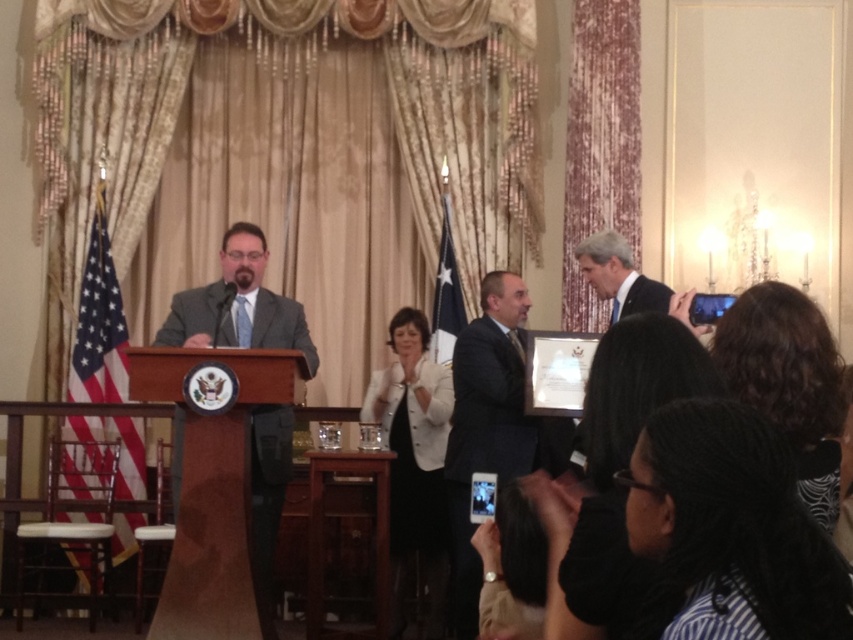
This screenshot has width=853, height=640. What do you see at coordinates (238, 305) in the screenshot?
I see `matte gray suit at left` at bounding box center [238, 305].

Which is more to the left, matte gray suit at left or dark blue suit at center?

matte gray suit at left is more to the left.

Locate an element on the screen. matte gray suit at left is located at coordinates (238, 305).

Locate an element on the screen. The height and width of the screenshot is (640, 853). matte gray suit at left is located at coordinates (238, 305).

Measure the distance between matte gray suit at left and camera.

matte gray suit at left is 11.56 meters from camera.

Is matte gray suit at left positioned before dark gray suit at center?

Yes, matte gray suit at left is in front of dark gray suit at center.

Is point (263, 593) farther from camera compared to point (486, 365)?

That is False.

Find the location of a particular element. The height and width of the screenshot is (640, 853). matte gray suit at left is located at coordinates (238, 305).

Who is taller, dark gray suit at center or dark blue suit at center?

With more height is dark gray suit at center.

Between point (495, 467) and point (672, 312), which one is positioned in front?

Point (672, 312) is more forward.

Find the location of a particular element. This screenshot has width=853, height=640. dark gray suit at center is located at coordinates (485, 426).